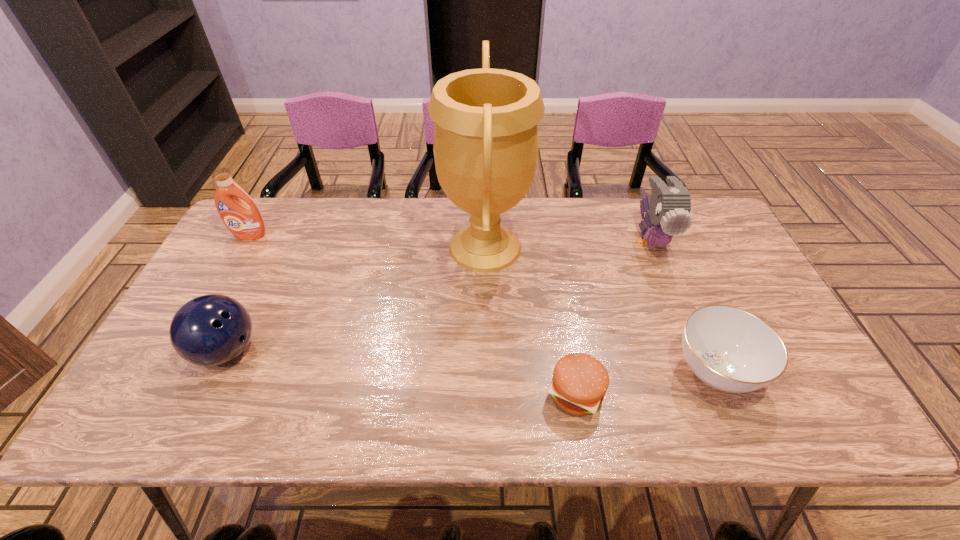
Identify the location of free space that satisfies the following two spatial constraints: 1. on the engravings side of the shortest object; 2. on the left side of the tallest object. The image size is (960, 540). (487, 393).

What are the coordinates of `free spot that satisfies the following two spatial constraints: 1. on the front-facing side of the detergent; 2. on the left side of the hamburger` in the screenshot? It's located at (163, 393).